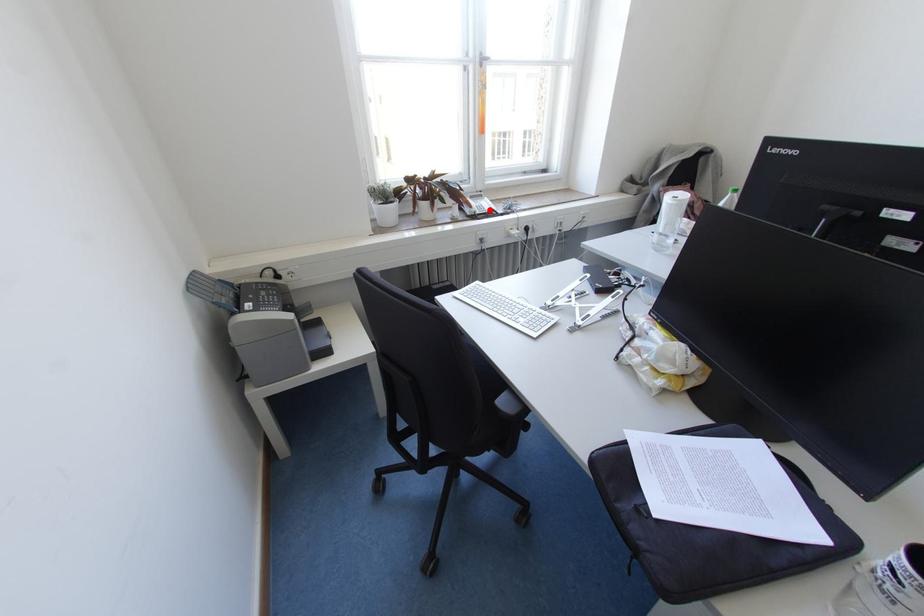
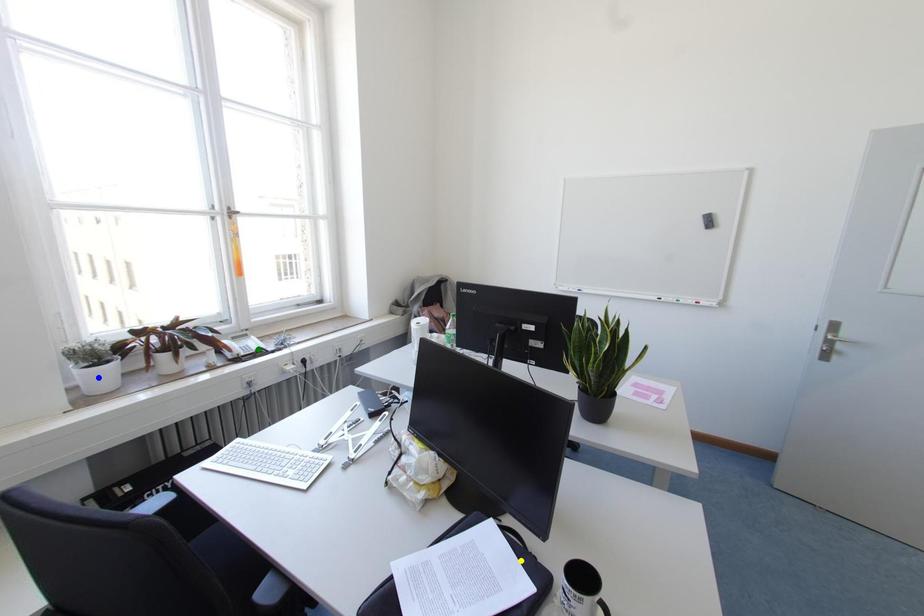
Question: I am providing you with two images of the same scene from different viewpoints. A red point is marked on the first image. You are given multiple points on the second image. Which spot in image 2 lines up with the point in image 1?

Choices:
 (A) green point
 (B) blue point
 (C) yellow point

Answer: (A)